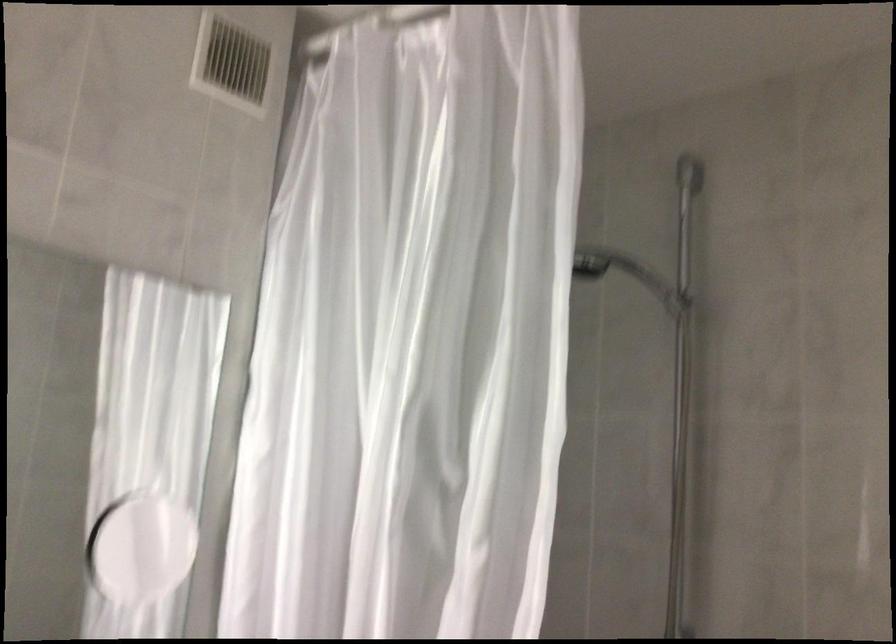
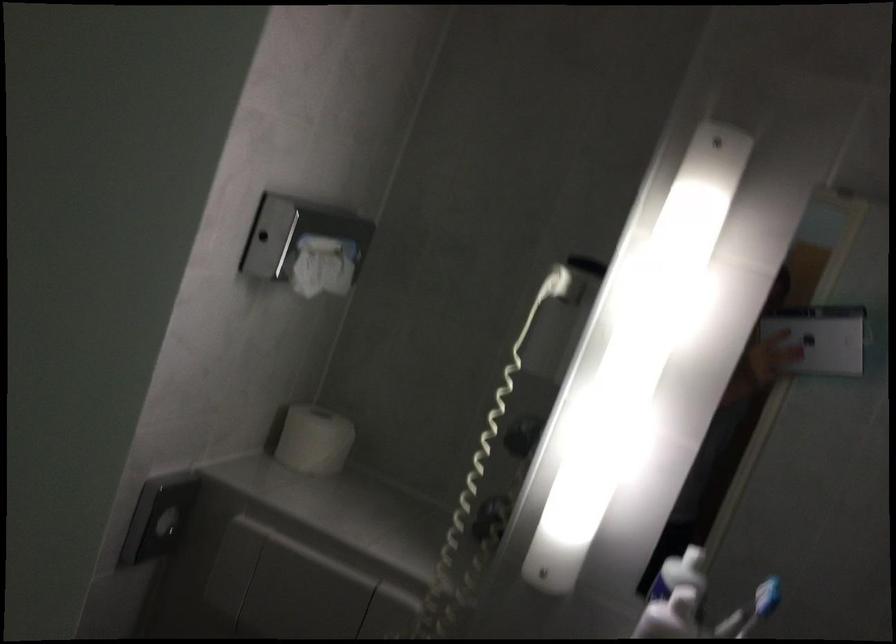
Question: The images are taken continuously from a first-person perspective. In which direction is your viewpoint rotating?

Choices:
 (A) Left
 (B) Right
 (C) Up
 (D) Down

Answer: (A)